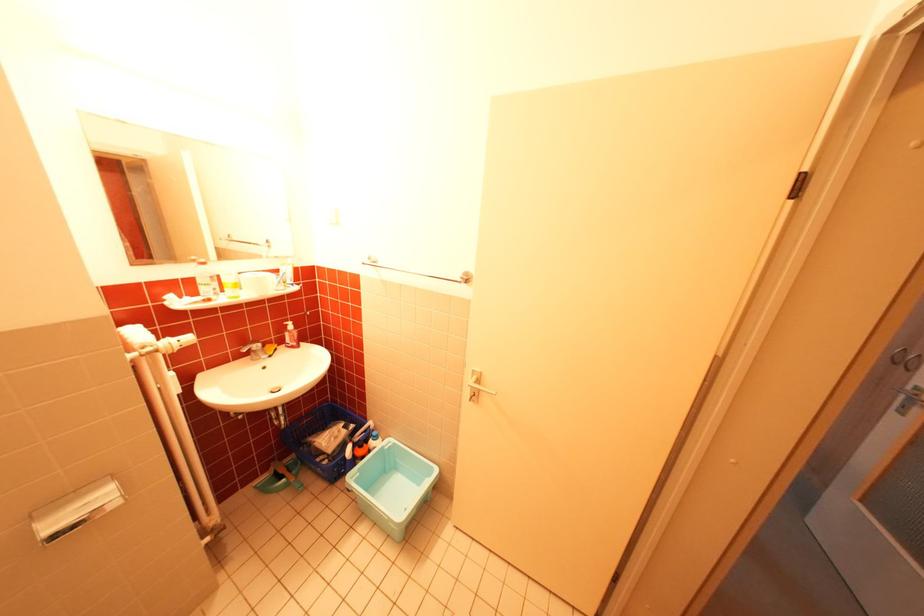
I want to click on white radiator valve, so click(x=165, y=345).